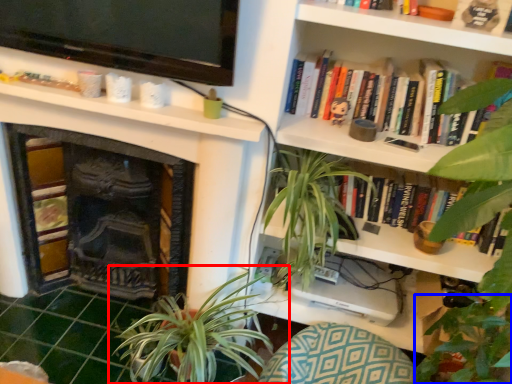
Question: Which object is closer to the camera taking this photo, houseplant (highlighted by a red box) or vegetation (highlighted by a blue box)?

Choices:
 (A) houseplant
 (B) vegetation

Answer: (A)